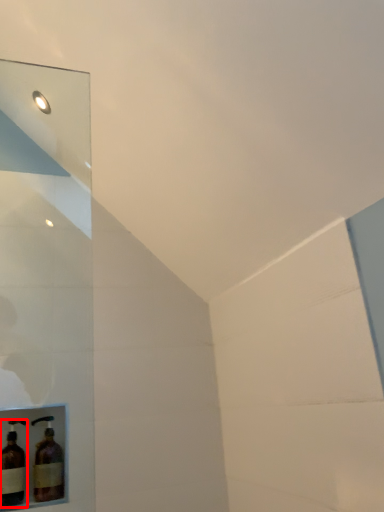
Question: Observing the image, what is the correct spatial positioning of bottle (annotated by the red box) in reference to bottle?

Choices:
 (A) left
 (B) right

Answer: (A)